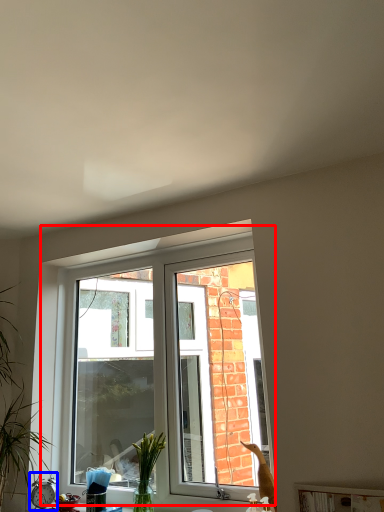
Question: Which of the following is the closest to the observer, window (highlighted by a red box) or alarm clock (highlighted by a blue box)?

Choices:
 (A) window
 (B) alarm clock

Answer: (A)